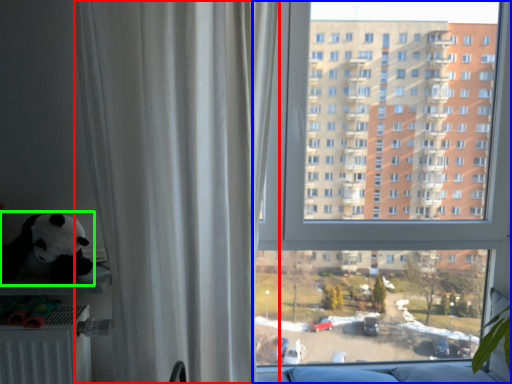
Question: Which object is the farthest from curtain (highlighted by a red box)? Choose among these: window (highlighted by a blue box) or toy (highlighted by a green box).

Choices:
 (A) window
 (B) toy

Answer: (A)